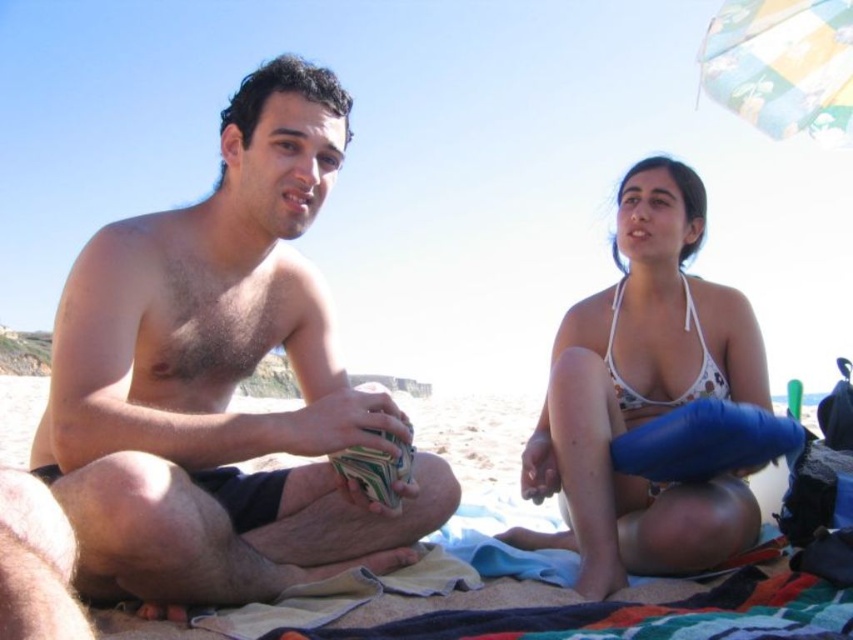
Question: Among these points, which one is nearest to the camera?

Choices:
 (A) (772, 64)
 (B) (727, 342)

Answer: (B)

Question: Does hairless skin at center lie in front of multicolored fabric umbrella at upper right?

Choices:
 (A) yes
 (B) no

Answer: (A)

Question: Among these objects, which one is farthest from the camera?

Choices:
 (A) multicolored fabric umbrella at upper right
 (B) white bikini top at center
 (C) white floral bikini top at upper right
 (D) hairless skin at center

Answer: (A)

Question: Is the position of hairless skin at center more distant than that of white bikini top at center?

Choices:
 (A) no
 (B) yes

Answer: (A)

Question: Does hairless skin at center have a lesser width compared to white floral bikini top at upper right?

Choices:
 (A) no
 (B) yes

Answer: (A)

Question: Which point is farther from the camera taking this photo?

Choices:
 (A) (738, 33)
 (B) (700, 356)
 (C) (70, 272)
 (D) (669, 292)

Answer: (A)